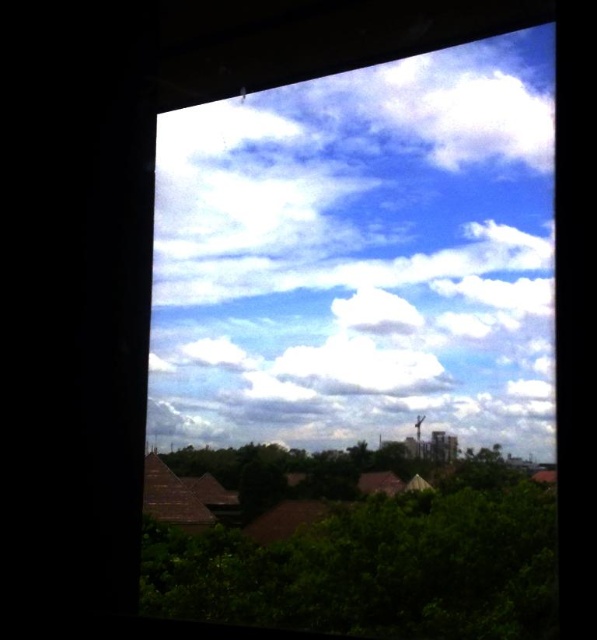
Question: Can you confirm if white fluffy cloud at upper center is positioned to the right of green leafy tree at lower left?

Choices:
 (A) yes
 (B) no

Answer: (A)

Question: Can you confirm if white fluffy cloud at upper center is smaller than green leafy tree at lower left?

Choices:
 (A) no
 (B) yes

Answer: (A)

Question: Is white fluffy cloud at upper center thinner than green leafy tree at lower left?

Choices:
 (A) yes
 (B) no

Answer: (A)